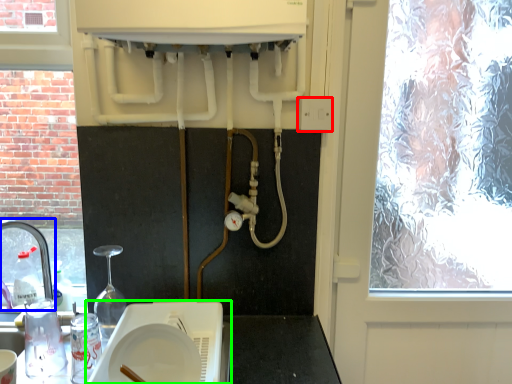
Question: Which object is the farthest from electric outlet (highlighted by a red box)? Choose among these: tap (highlighted by a blue box) or appliance (highlighted by a green box).

Choices:
 (A) tap
 (B) appliance

Answer: (A)